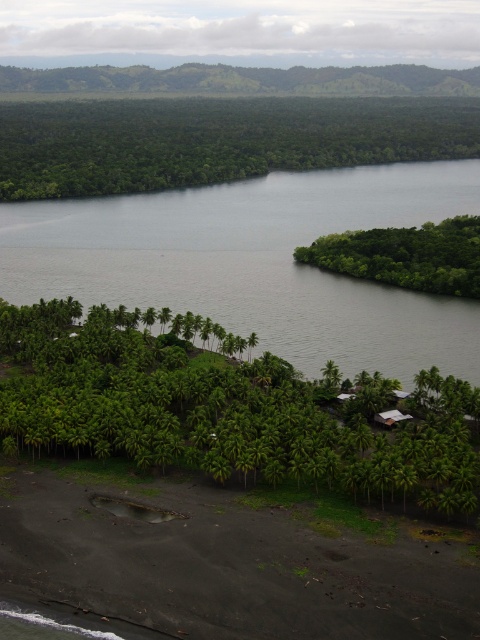
Between green leafy forest at upper center and green leafy island at right, which one is positioned higher?

Positioned higher is green leafy forest at upper center.

Is point (289, 156) more distant than point (372, 243)?

Yes, it is.

You are a GUI agent. You are given a task and a screenshot of the screen. Output one action in this format:
    pyautogui.click(x=<x>, y=<y>)
    Task: Click on the green leafy forest at upper center
    The height and width of the screenshot is (640, 480).
    Given the screenshot: What is the action you would take?
    pyautogui.click(x=216, y=140)

Is green leafy palm trees at lower center positioned before green leafy forest at upper center?

Yes, it is in front of green leafy forest at upper center.

From the picture: Which is above, green leafy palm trees at lower center or green leafy forest at upper center?

green leafy forest at upper center

Which is in front, point (363, 449) or point (156, 100)?

Point (363, 449) is more forward.

This screenshot has height=640, width=480. What are the coordinates of `green leafy palm trees at lower center` in the screenshot? It's located at [x=223, y=408].

Does green leafy palm trees at lower center appear over green leafy island at right?

No.

Measure the distance between point (95, 344) and camera.

Point (95, 344) and camera are 188.81 meters apart.

Looking at this image, who is more distant from viewer, (308, 413) or (459, 280)?

Point (459, 280)

This screenshot has height=640, width=480. I want to click on green leafy palm trees at lower center, so click(x=223, y=408).